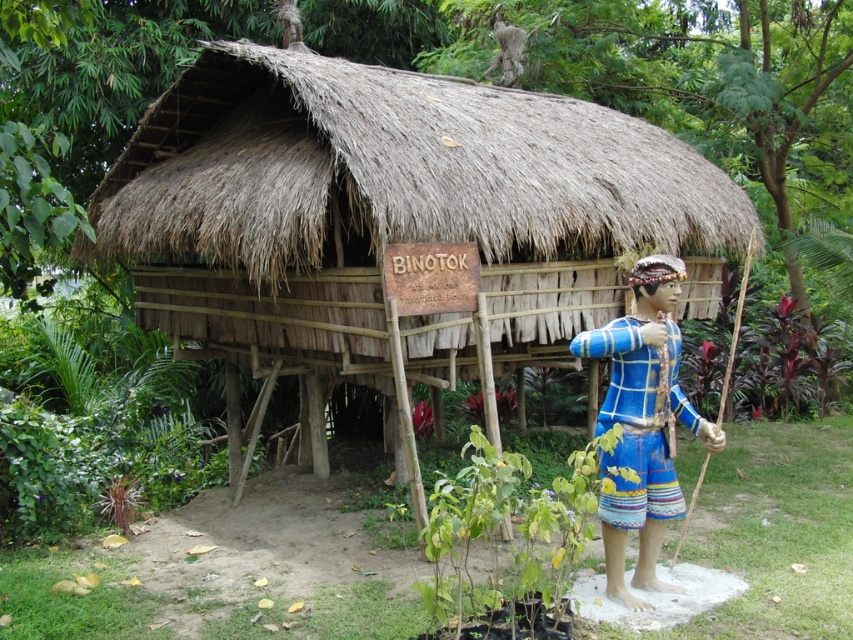
Which is below, thatched wood hut at center or blue woven fabric at right?

Positioned lower is blue woven fabric at right.

The width and height of the screenshot is (853, 640). Identify the location of thatched wood hut at center. (390, 209).

Where is `thatched wood hut at center`? The image size is (853, 640). thatched wood hut at center is located at coordinates (390, 209).